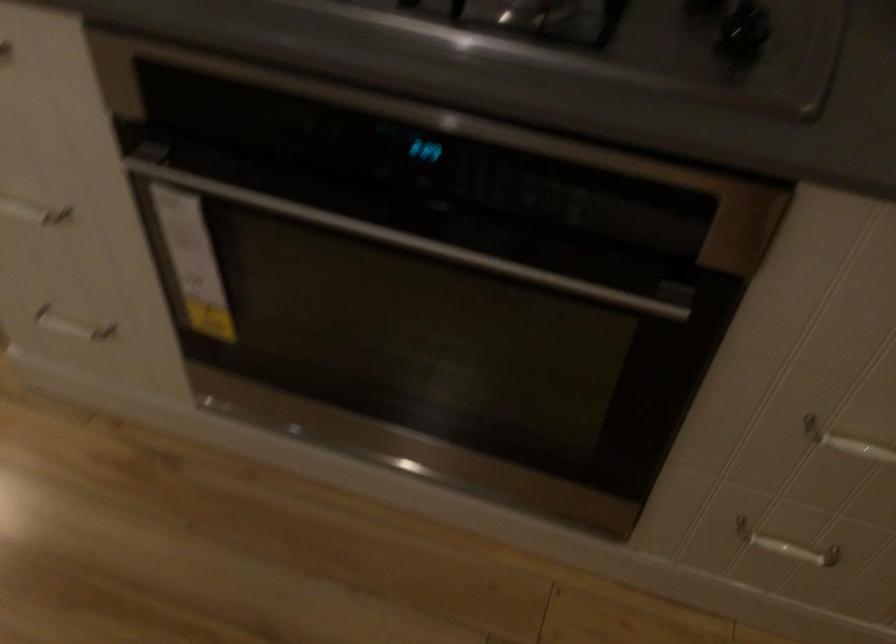
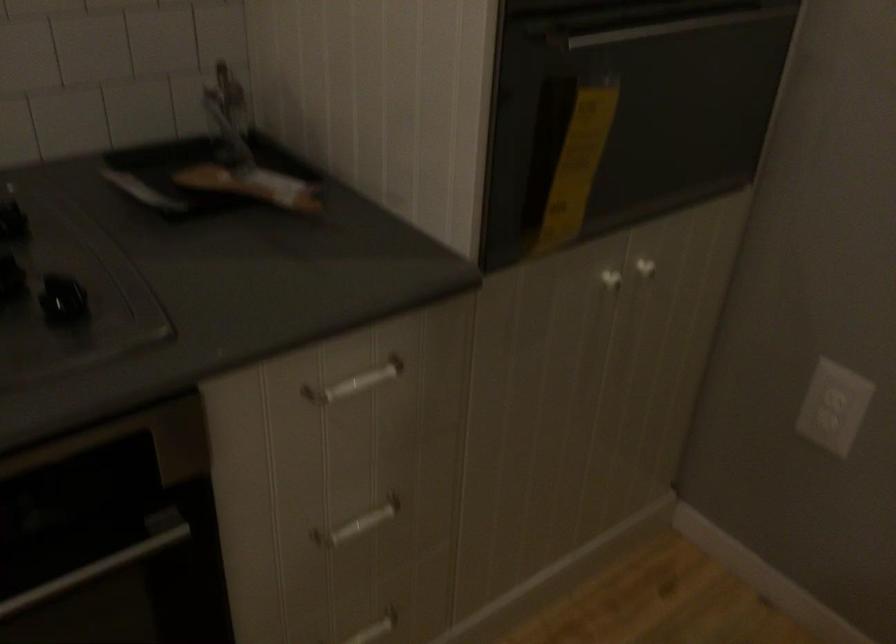
In the second image, find the point that corresponds to the point at 574,281 in the first image.

(97, 567)